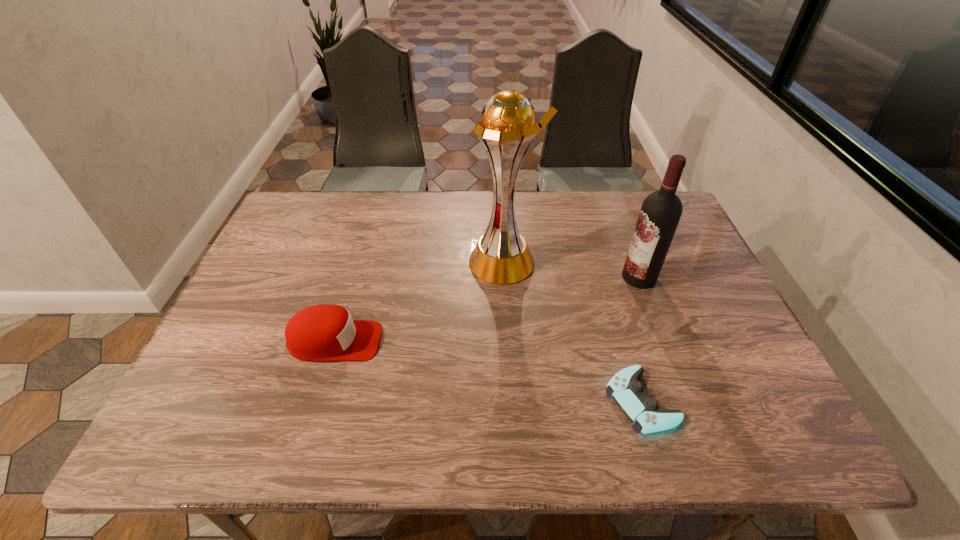
Identify the location of vacant region between the second tallest object and the tallest object. This screenshot has height=540, width=960. (571, 269).

Locate an element on the screen. The height and width of the screenshot is (540, 960). free spot between the third farthest object and the tallest object is located at coordinates (420, 301).

Where is `free space between the tallest object and the third shortest object`? free space between the tallest object and the third shortest object is located at coordinates (571, 269).

This screenshot has width=960, height=540. Find the location of `free space between the shortest object and the leftmost object`. free space between the shortest object and the leftmost object is located at coordinates (488, 371).

Where is `the second closest object to the third shortest object`? the second closest object to the third shortest object is located at coordinates (628, 393).

Where is `object that ranks as the closest to the wine bottle`? object that ranks as the closest to the wine bottle is located at coordinates (501, 256).

This screenshot has width=960, height=540. I want to click on vacant space that satisfies the following two spatial constraints: 1. on the front-facing side of the nearest object; 2. on the right side of the leftmost object, so click(317, 401).

The image size is (960, 540). Find the location of `free space that satisfies the following two spatial constraints: 1. on the front-facing side of the trophy; 2. on the left side of the control`. free space that satisfies the following two spatial constraints: 1. on the front-facing side of the trophy; 2. on the left side of the control is located at coordinates (512, 401).

The height and width of the screenshot is (540, 960). I want to click on vacant space that satisfies the following two spatial constraints: 1. on the front-facing side of the control; 2. on the left side of the second nearest object, so click(x=317, y=401).

In order to click on vacant position in the image that satisfies the following two spatial constraints: 1. on the front-facing side of the third tallest object; 2. on the right side of the shortest object in this screenshot , I will do `click(317, 401)`.